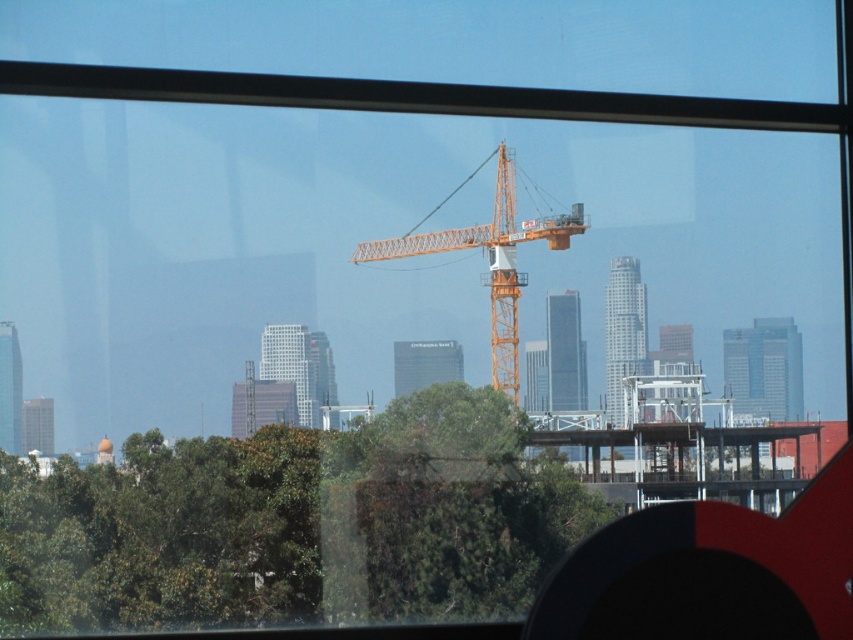
Find the location of `green leafy tree at center`. green leafy tree at center is located at coordinates (294, 524).

Between green leafy tree at center and orange metallic crane at center, which one has more height?

orange metallic crane at center

Does point (479, 465) come in front of point (491, 353)?

That is True.

In order to click on green leafy tree at center in this screenshot , I will do `click(294, 524)`.